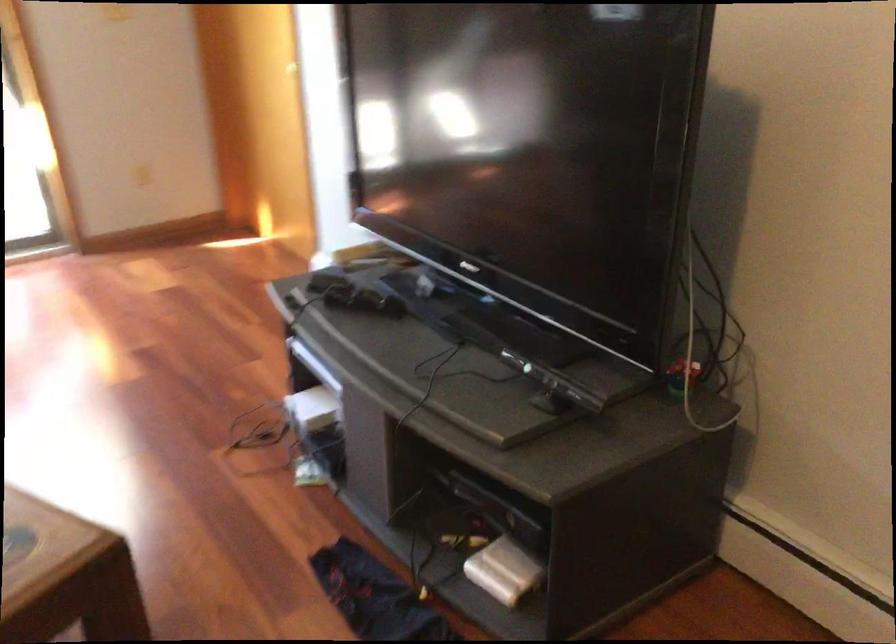
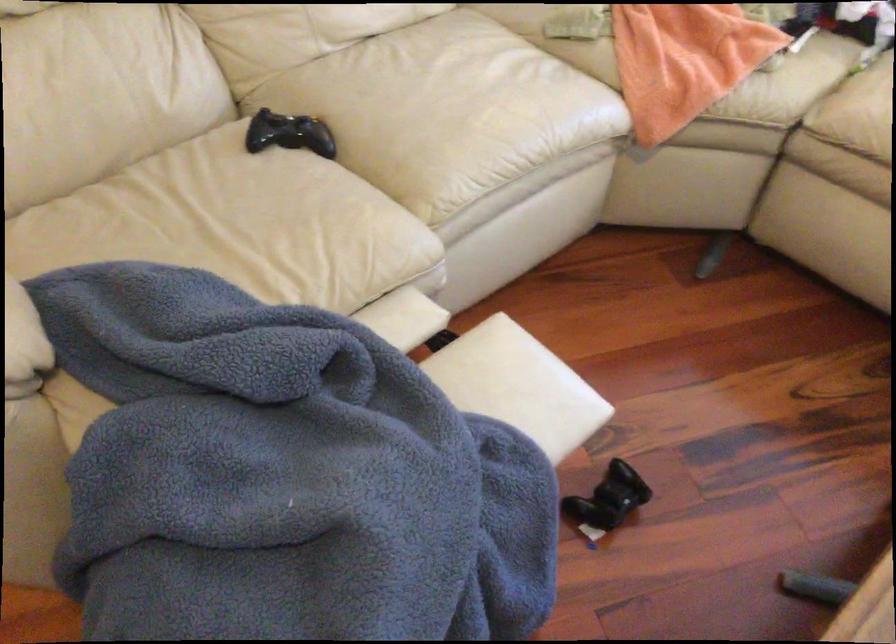
The first image is from the beginning of the video and the second image is from the end. How did the camera likely rotate when shooting the video?

The camera's rotation is toward left-down.